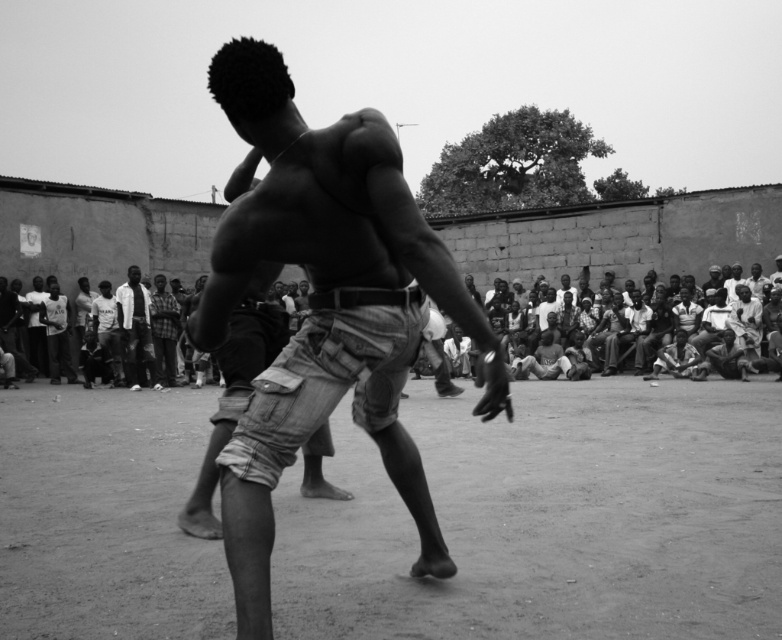
You are a photographer standing at the point labeled as point (x=144, y=332). You want to take a photo of the wrestling match from a distance of 60 feet. Is the camera positioned correctly to capture the entire wrestling area?

The point (x=144, y=332) and camera are 60.27 feet apart, so yes, the camera is positioned correctly to capture the entire wrestling area since the distance is just over 60 feet.